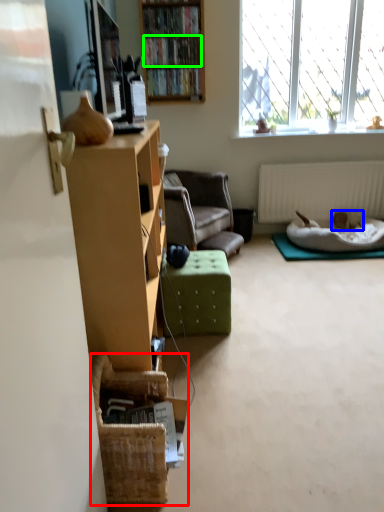
Question: Which object is the closest to the basket (highlighted by a red box)? Choose among these: animal (highlighted by a blue box) or book (highlighted by a green box).

Choices:
 (A) animal
 (B) book

Answer: (A)